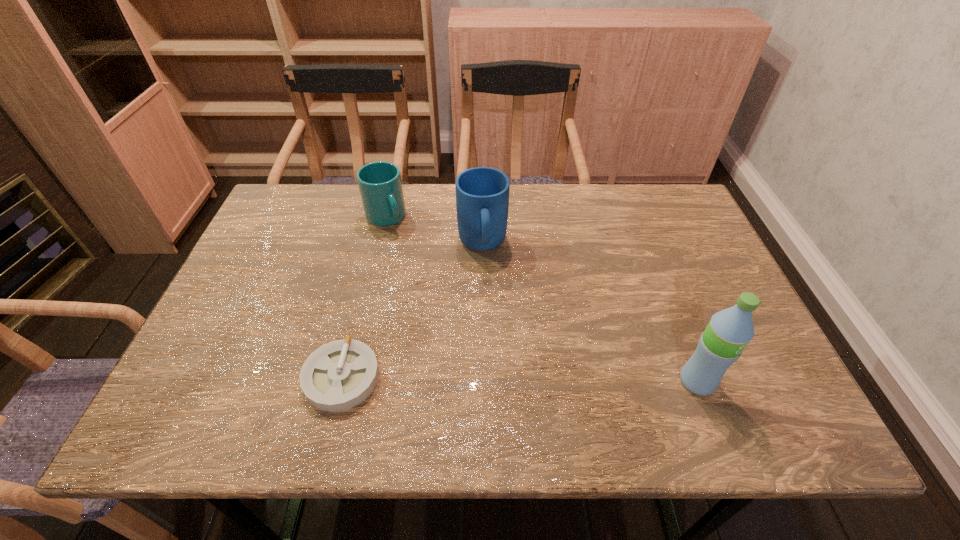
Find the location of `free space between the third object from left to right and the shortest object`. free space between the third object from left to right and the shortest object is located at coordinates coord(412,311).

Identify the location of free point between the rightmost object and the second object from right to left. Image resolution: width=960 pixels, height=540 pixels. (589, 313).

Where is `vacant area between the cup and the mug`? vacant area between the cup and the mug is located at coordinates (434, 231).

Locate an element on the screen. This screenshot has width=960, height=540. free area in between the shortest object and the tallest object is located at coordinates tap(519, 380).

What are the coordinates of `vacant area that lies between the rightmost object and the third tallest object` in the screenshot? It's located at (541, 300).

Identify which object is the second nearest to the second shortest object. Please provide its 2D coordinates. Your answer should be formatted as a tuple, i.e. [(x, y)], where the tuple contains the x and y coordinates of a point satisfying the conditions above.

[(339, 375)]

Identify which object is located as the third nearest to the third shortest object. Please provide its 2D coordinates. Your answer should be formatted as a tuple, i.e. [(x, y)], where the tuple contains the x and y coordinates of a point satisfying the conditions above.

[(729, 331)]

The width and height of the screenshot is (960, 540). What are the coordinates of `blank area in the image that satisfies the following two spatial constraints: 1. on the front side of the ashtray; 2. on the right side of the tallest object` in the screenshot? It's located at (341, 382).

Locate an element on the screen. This screenshot has width=960, height=540. free space that satisfies the following two spatial constraints: 1. on the front side of the water bottle; 2. on the left side of the cup is located at coordinates (347, 382).